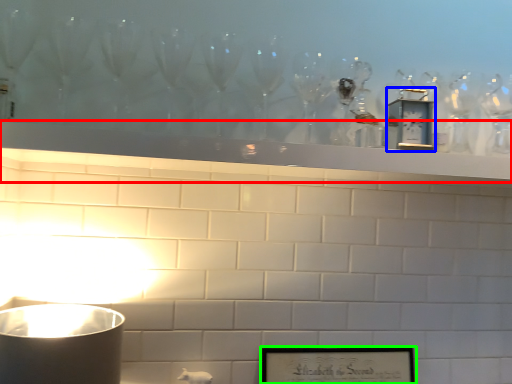
Question: Which is nearer to the mantle (highlighted by a red box)? clock (highlighted by a blue box) or picture frame (highlighted by a green box).

Choices:
 (A) clock
 (B) picture frame

Answer: (A)